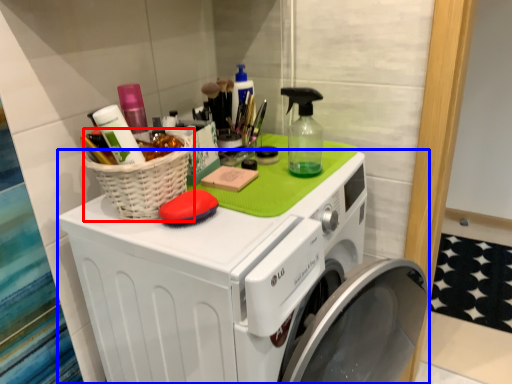
Question: Which point is further to the camera, basket (highlighted by a red box) or washing machine (highlighted by a blue box)?

Choices:
 (A) basket
 (B) washing machine

Answer: (A)